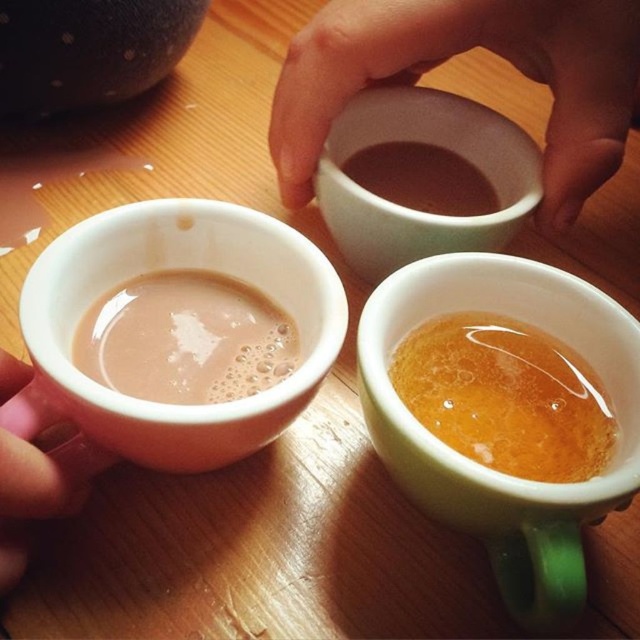
Where is `matte white cup at upper center`? The image size is (640, 640). matte white cup at upper center is located at coordinates (460, 52).

Looking at this image, is matte white cup at upper center positioned before matte ceramic mug at lower left?

No, matte white cup at upper center is further to the viewer.

Which is behind, point (577, 42) or point (257, 339)?

Positioned behind is point (577, 42).

Identify the location of matte white cup at upper center. This screenshot has height=640, width=640. (460, 52).

Does matte ceramic mug at left appear on the left side of pink flesh at lower left?

In fact, matte ceramic mug at left is to the right of pink flesh at lower left.

You are a GUI agent. You are given a task and a screenshot of the screen. Output one action in this format:
    pyautogui.click(x=<x>, y=<y>)
    Task: Click on the matte ceramic mug at left
    The height and width of the screenshot is (640, 640).
    Given the screenshot: What is the action you would take?
    pyautogui.click(x=180, y=268)

Between point (182, 426) and point (35, 452), which one is positioned behind?

Positioned behind is point (35, 452).

You are a GUI agent. You are given a task and a screenshot of the screen. Output one action in this format:
    pyautogui.click(x=<x>, y=<y>)
    Task: Click on the matte ceramic mug at left
    
    Given the screenshot: What is the action you would take?
    pyautogui.click(x=180, y=268)

Can you confirm if green matte mug at lower right is wider than matte ceramic mug at lower left?

Correct, the width of green matte mug at lower right exceeds that of matte ceramic mug at lower left.

Is green matte mug at lower right below matte ceramic mug at lower left?

Indeed, green matte mug at lower right is positioned under matte ceramic mug at lower left.

Which is behind, point (580, 321) or point (257, 337)?

The point (257, 337) is more distant.

You are a GUI agent. You are given a task and a screenshot of the screen. Output one action in this format:
    pyautogui.click(x=<x>, y=<y>)
    Task: Click on the green matte mug at lower right
    
    Given the screenshot: What is the action you would take?
    pyautogui.click(x=477, y=465)